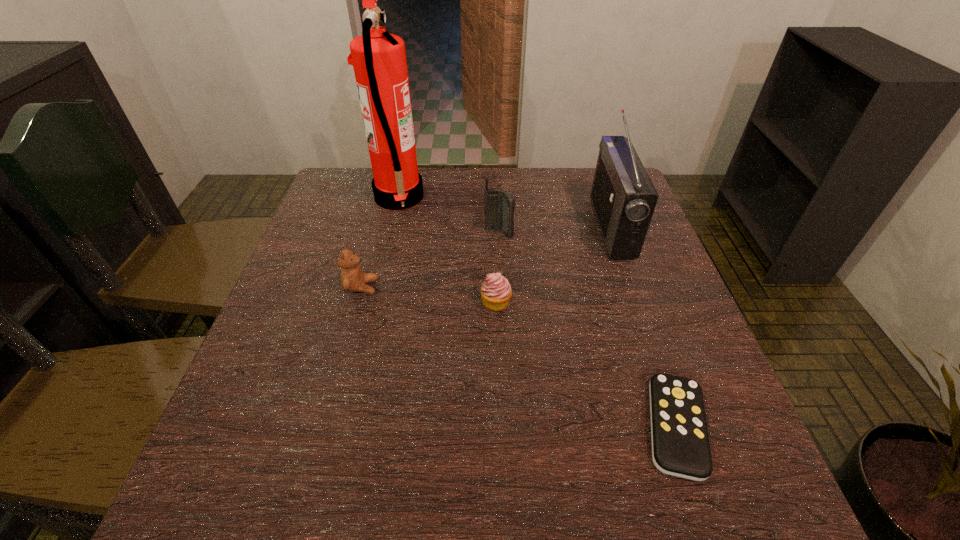
Where is `radio receiver situated at the right edge`? radio receiver situated at the right edge is located at coordinates (623, 197).

You are a GUI agent. You are given a task and a screenshot of the screen. Output one action in this format:
    pyautogui.click(x=<x>, y=<y>)
    Task: Click on the remote control that is at the right edge
    The height and width of the screenshot is (540, 960).
    Given the screenshot: What is the action you would take?
    pyautogui.click(x=680, y=443)

Identify the location of object that is at the far left corner. (379, 60).

Identify the location of object positioned at the far right corner. click(x=623, y=197).

Where is `object situated at the near right corner`? The width and height of the screenshot is (960, 540). object situated at the near right corner is located at coordinates (680, 443).

I want to click on free space at the far edge of the desktop, so click(471, 210).

Where is `free location at the near edge of the desktop`? free location at the near edge of the desktop is located at coordinates (430, 494).

The height and width of the screenshot is (540, 960). In order to click on free location at the left edge in this screenshot , I will do `click(319, 303)`.

The width and height of the screenshot is (960, 540). In the image, there is a desktop. In order to click on free space at the right edge in this screenshot , I will do `click(721, 419)`.

I want to click on free space at the far left corner of the desktop, so click(357, 180).